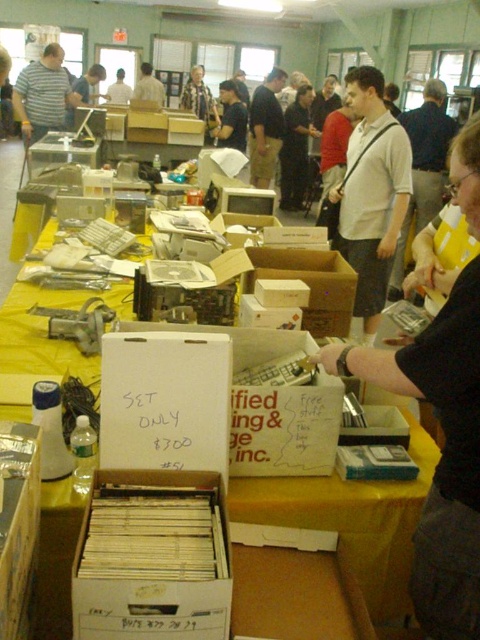
Looking at this image, you are a customer at the flea market and see the brown cardboard box at center and the light brown shirt at center. Which item is closer to you?

The brown cardboard box at center is closer to you because it is positioned under the light brown shirt at center, meaning the shirt is above it and further away.

You are organizing a garage sale and have two boxes to place on a table. The yellow cardboard box at lower left and the brown cardboard box at center. You want to arrange them so that the smaller one is on the left side of the table. Which box should you place on the left?

The yellow cardboard box at lower left is smaller than the brown cardboard box at center, so you should place the yellow cardboard box at lower left on the left side of the table.